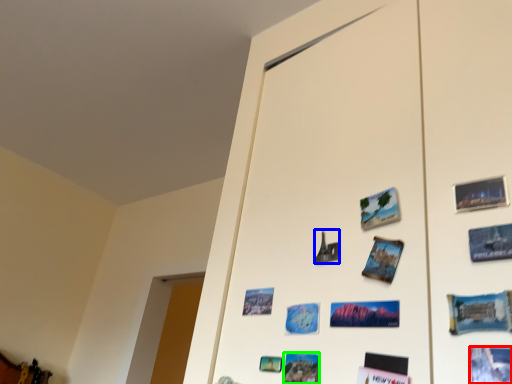
Question: Based on their relative distances, which object is nearer to postcard (highlighted by a red box)? Choose from art (highlighted by a blue box) and postcard (highlighted by a green box).

Choices:
 (A) art
 (B) postcard

Answer: (B)